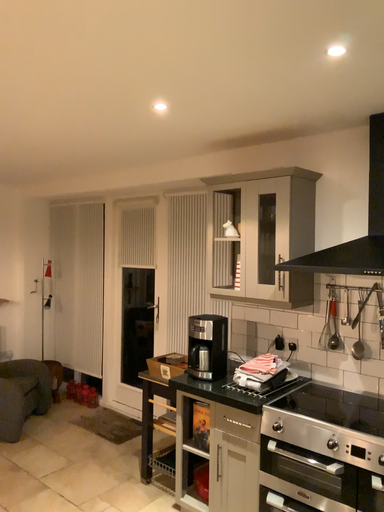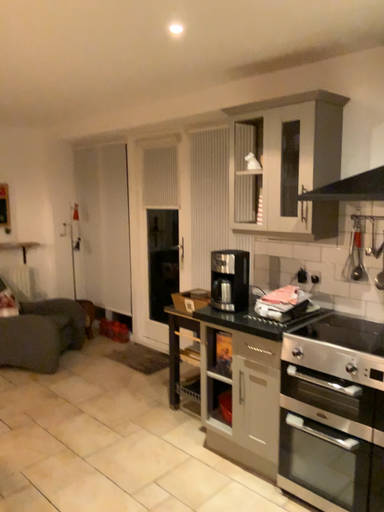
Question: How did the camera likely rotate when shooting the video?

Choices:
 (A) rotated upward
 (B) rotated downward

Answer: (B)